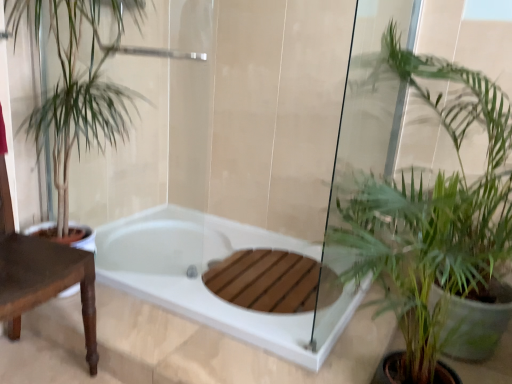
Image resolution: width=512 pixels, height=384 pixels. What are the coordinates of `white glossy bathtub at center` in the screenshot? It's located at (200, 277).

This screenshot has width=512, height=384. Identify the location of green leafy plant at left, which is counted as the first houseplant, starting from the left. (82, 92).

Find the location of a particular element. The height and width of the screenshot is (384, 512). white glossy bathtub at center is located at coordinates (200, 277).

Can you tell me how much green leafy plant at lower right, the 2th houseplant when ordered from left to right, and brown wooden table at left differ in facing direction?

There is a 89.3-degree angle between the facing directions of green leafy plant at lower right, the 2th houseplant when ordered from left to right, and brown wooden table at left.

Which of these two, green leafy plant at lower right, the 1th houseplant when ordered from right to left, or brown wooden table at left, is smaller?

Smaller between the two is brown wooden table at left.

Considering the relative positions of green leafy plant at lower right, the 1th houseplant when ordered from right to left, and brown wooden table at left in the image provided, is green leafy plant at lower right, the 1th houseplant when ordered from right to left, to the left of brown wooden table at left from the viewer's perspective?

→ No.

Is green leafy plant at lower right, the 1th houseplant when ordered from right to left, wider than brown wooden table at left?

Yes, green leafy plant at lower right, the 1th houseplant when ordered from right to left, is wider than brown wooden table at left.

Is green leafy plant at lower right, the 2th houseplant when ordered from left to right, spatially inside green leafy plant at left, which appears as the second houseplant when viewed from the right, or outside of it?

green leafy plant at lower right, the 2th houseplant when ordered from left to right, cannot be found inside green leafy plant at left, which appears as the second houseplant when viewed from the right.

Which of these two, green leafy plant at lower right, the 1th houseplant when ordered from right to left, or green leafy plant at left, which is counted as the first houseplant, starting from the left, stands shorter?

green leafy plant at left, which is counted as the first houseplant, starting from the left.

Consider the image. Considering the relative sizes of green leafy plant at lower right, the 1th houseplant when ordered from right to left, and green leafy plant at left, which appears as the second houseplant when viewed from the right, in the image provided, is green leafy plant at lower right, the 1th houseplant when ordered from right to left, smaller than green leafy plant at left, which appears as the second houseplant when viewed from the right,?

No, green leafy plant at lower right, the 1th houseplant when ordered from right to left, is not smaller than green leafy plant at left, which appears as the second houseplant when viewed from the right.

From a real-world perspective, is green leafy plant at lower right, the 1th houseplant when ordered from right to left, under green leafy plant at left, which is counted as the first houseplant, starting from the left?

No.

From a real-world perspective, is green leafy plant at left, which is counted as the first houseplant, starting from the left, positioned above or below white glossy bathtub at center?

Clearly, from a real-world perspective, green leafy plant at left, which is counted as the first houseplant, starting from the left, is above white glossy bathtub at center.

Who is shorter, green leafy plant at left, which is counted as the first houseplant, starting from the left, or white glossy bathtub at center?

Standing shorter between the two is white glossy bathtub at center.

Is white glossy bathtub at center at the back of green leafy plant at left, which is counted as the first houseplant, starting from the left?

That's not correct — green leafy plant at left, which is counted as the first houseplant, starting from the left, is not looking away from white glossy bathtub at center.

From a real-world perspective, is white glossy bathtub at center physically located above or below brown wooden table at left?

From a real-world perspective, white glossy bathtub at center is physically below brown wooden table at left.

Considering the sizes of objects white glossy bathtub at center and brown wooden table at left in the image provided, who is thinner, white glossy bathtub at center or brown wooden table at left?

With smaller width is brown wooden table at left.

Which object is further away from the camera, white glossy bathtub at center or brown wooden table at left?

white glossy bathtub at center is further from the camera.

Considering the relative sizes of white glossy bathtub at center and brown wooden table at left in the image provided, is white glossy bathtub at center smaller than brown wooden table at left?

Correct, white glossy bathtub at center occupies less space than brown wooden table at left.

Could you tell me if brown wooden table at left is turned towards white glossy bathtub at center?

No, brown wooden table at left does not turn towards white glossy bathtub at center.

Considering the points (26, 300) and (152, 233), which point is in front, point (26, 300) or point (152, 233)?

The point (26, 300) is more forward.

Find the location of a particular element. bathtub that appears below the brown wooden table at left (from a real-world perspective) is located at coordinates (200, 277).

From the image's perspective, who appears lower, brown wooden table at left or white glossy bathtub at center?

white glossy bathtub at center appears lower in the image.

Consider the image. From a real-world perspective, is brown wooden table at left physically above green leafy plant at lower right, the 1th houseplant when ordered from right to left?

Actually, brown wooden table at left is physically below green leafy plant at lower right, the 1th houseplant when ordered from right to left, in the real world.

Is brown wooden table at left positioned before green leafy plant at lower right, the 2th houseplant when ordered from left to right?

No, it is not.

Is brown wooden table at left positioned with its back to green leafy plant at lower right, the 1th houseplant when ordered from right to left?

A: That's not correct — brown wooden table at left is not looking away from green leafy plant at lower right, the 1th houseplant when ordered from right to left.

Are brown wooden table at left and green leafy plant at lower right, the 1th houseplant when ordered from right to left, beside each other?

No.

Measure the distance from brown wooden table at left to green leafy plant at left, which appears as the second houseplant when viewed from the right.

21.73 inches.

Which is in front, point (54, 273) or point (75, 45)?

The point (54, 273) is closer to the camera.

Would you say green leafy plant at left, which is counted as the first houseplant, starting from the left, is part of brown wooden table at left's contents?

No, green leafy plant at left, which is counted as the first houseplant, starting from the left, is not surrounded by brown wooden table at left.

Is brown wooden table at left aimed at green leafy plant at left, which is counted as the first houseplant, starting from the left?

No, brown wooden table at left is not aimed at green leafy plant at left, which is counted as the first houseplant, starting from the left.

Find the location of a particular element. This screenshot has width=512, height=384. table that is under the green leafy plant at lower right, the 2th houseplant when ordered from left to right (from a real-world perspective) is located at coordinates (45, 282).

The height and width of the screenshot is (384, 512). Find the location of `houseplant above the green leafy plant at lower right, the 1th houseplant when ordered from right to left (from the image's perspective)`. houseplant above the green leafy plant at lower right, the 1th houseplant when ordered from right to left (from the image's perspective) is located at coordinates (82, 92).

Which object lies further to the anchor point brown wooden table at left, green leafy plant at lower right, the 1th houseplant when ordered from right to left, or white glossy bathtub at center?

Among the two, green leafy plant at lower right, the 1th houseplant when ordered from right to left, is located further to brown wooden table at left.

Which object lies nearer to the anchor point white glossy bathtub at center, brown wooden table at left or green leafy plant at lower right, the 2th houseplant when ordered from left to right?

Based on the image, brown wooden table at left appears to be nearer to white glossy bathtub at center.

Based on their spatial positions, is white glossy bathtub at center or green leafy plant at lower right, the 1th houseplant when ordered from right to left, further from brown wooden table at left?

green leafy plant at lower right, the 1th houseplant when ordered from right to left, is further to brown wooden table at left.

Based on their spatial positions, is brown wooden table at left or white glossy bathtub at center further from green leafy plant at left, which appears as the second houseplant when viewed from the right?

white glossy bathtub at center is further to green leafy plant at left, which appears as the second houseplant when viewed from the right.

From the image, which object appears to be farther from white glossy bathtub at center, green leafy plant at lower right, the 1th houseplant when ordered from right to left, or brown wooden table at left?

green leafy plant at lower right, the 1th houseplant when ordered from right to left, is further to white glossy bathtub at center.

Which object lies nearer to the anchor point brown wooden table at left, green leafy plant at left, which is counted as the first houseplant, starting from the left, or white glossy bathtub at center?

green leafy plant at left, which is counted as the first houseplant, starting from the left, is positioned closer to the anchor brown wooden table at left.

Based on the photo, estimate the real-world distances between objects in this image. Which object is further from white glossy bathtub at center, green leafy plant at left, which is counted as the first houseplant, starting from the left, or brown wooden table at left?

The object further to white glossy bathtub at center is green leafy plant at left, which is counted as the first houseplant, starting from the left.

Which object lies nearer to the anchor point green leafy plant at left, which appears as the second houseplant when viewed from the right, brown wooden table at left or green leafy plant at lower right, the 2th houseplant when ordered from left to right?

Based on the image, brown wooden table at left appears to be nearer to green leafy plant at left, which appears as the second houseplant when viewed from the right.

What are the coordinates of `houseplant located between brown wooden table at left and green leafy plant at lower right, the 1th houseplant when ordered from right to left, in the left-right direction` in the screenshot? It's located at (82, 92).

The height and width of the screenshot is (384, 512). What are the coordinates of `houseplant located between brown wooden table at left and white glossy bathtub at center in the left-right direction` in the screenshot? It's located at (82, 92).

In order to click on bathtub situated between green leafy plant at left, which is counted as the first houseplant, starting from the left, and green leafy plant at lower right, the 2th houseplant when ordered from left to right, from left to right in this screenshot , I will do `click(200, 277)`.

The width and height of the screenshot is (512, 384). Identify the location of bathtub situated between brown wooden table at left and green leafy plant at lower right, the 2th houseplant when ordered from left to right, from left to right. (200, 277).